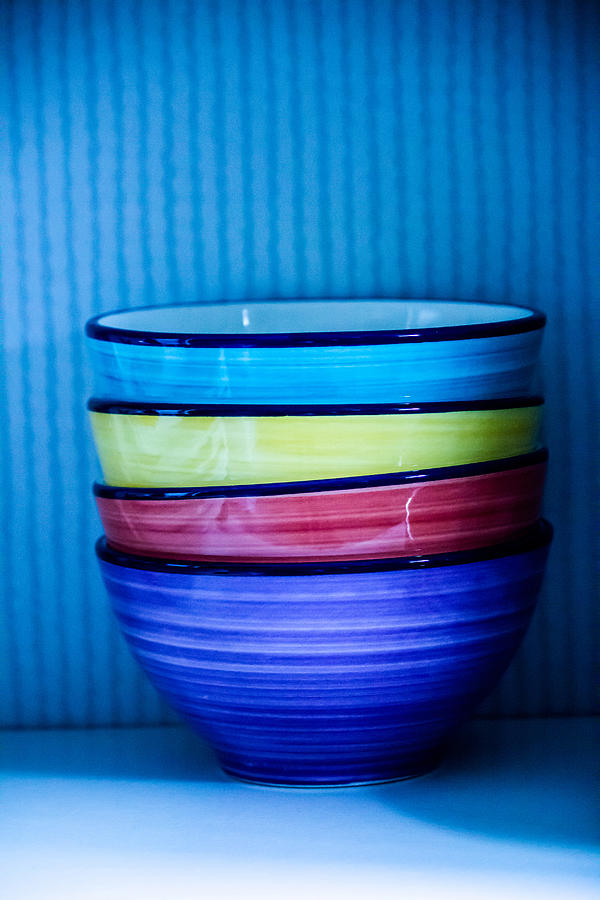
I want to click on bowl, so click(305, 642), click(339, 515), click(297, 442), click(305, 371).